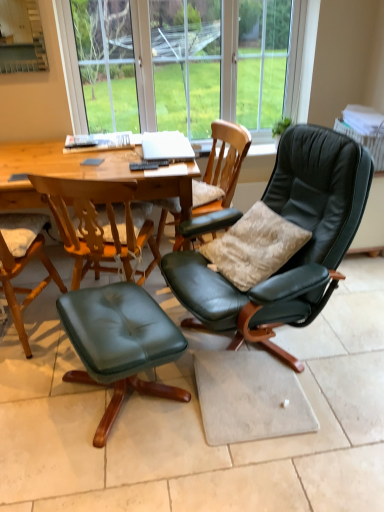
Question: Is matte black leather chair at center, the 1th chair viewed from the right, closer to the viewer compared to matte green leather chair at lower left, the 3th chair in the right-to-left sequence?

Choices:
 (A) yes
 (B) no

Answer: (A)

Question: Does matte black leather chair at center, marked as the 3th chair in a left-to-right arrangement, lie behind matte green leather chair at lower left, acting as the 1th chair starting from the left?

Choices:
 (A) no
 (B) yes

Answer: (A)

Question: Does matte black leather chair at center, marked as the 3th chair in a left-to-right arrangement, have a lesser width compared to matte green leather chair at lower left, acting as the 1th chair starting from the left?

Choices:
 (A) yes
 (B) no

Answer: (B)

Question: From a real-world perspective, is matte black leather chair at center, marked as the 3th chair in a left-to-right arrangement, located higher than matte green leather chair at lower left, the 3th chair in the right-to-left sequence?

Choices:
 (A) yes
 (B) no

Answer: (A)

Question: From a real-world perspective, is matte black leather chair at center, the 1th chair viewed from the right, located beneath matte green leather chair at lower left, the 3th chair in the right-to-left sequence?

Choices:
 (A) no
 (B) yes

Answer: (A)

Question: From the image's perspective, is wooden round table at center located above or below matte black leather chair at center, which is the second chair from left to right?

Choices:
 (A) below
 (B) above

Answer: (A)

Question: From a real-world perspective, is wooden round table at center above or below matte black leather chair at center, which is the second chair from left to right?

Choices:
 (A) below
 (B) above

Answer: (A)

Question: Is wooden round table at center wider or thinner than matte black leather chair at center, marked as the second chair in a right-to-left arrangement?

Choices:
 (A) wide
 (B) thin

Answer: (A)

Question: Is wooden round table at center inside the boundaries of matte black leather chair at center, marked as the second chair in a right-to-left arrangement, or outside?

Choices:
 (A) outside
 (B) inside

Answer: (A)

Question: From their relative heights in the image, would you say green leather ottoman at lower left is taller or shorter than velvet beige pillow at center right?

Choices:
 (A) short
 (B) tall

Answer: (A)

Question: Is point (117, 381) closer or farther from the camera than point (223, 252)?

Choices:
 (A) farther
 (B) closer

Answer: (B)

Question: In the image, is green leather ottoman at lower left positioned in front of or behind velvet beige pillow at center right?

Choices:
 (A) front
 (B) behind

Answer: (A)

Question: Considering the positions of green leather ottoman at lower left and velvet beige pillow at center right in the image, is green leather ottoman at lower left bigger or smaller than velvet beige pillow at center right?

Choices:
 (A) small
 (B) big

Answer: (B)

Question: Does point (236, 160) appear closer or farther from the camera than point (288, 221)?

Choices:
 (A) closer
 (B) farther

Answer: (B)

Question: From their relative heights in the image, would you say matte black leather chair at center, marked as the second chair in a right-to-left arrangement, is taller or shorter than velvet beige pillow at center right?

Choices:
 (A) short
 (B) tall

Answer: (B)